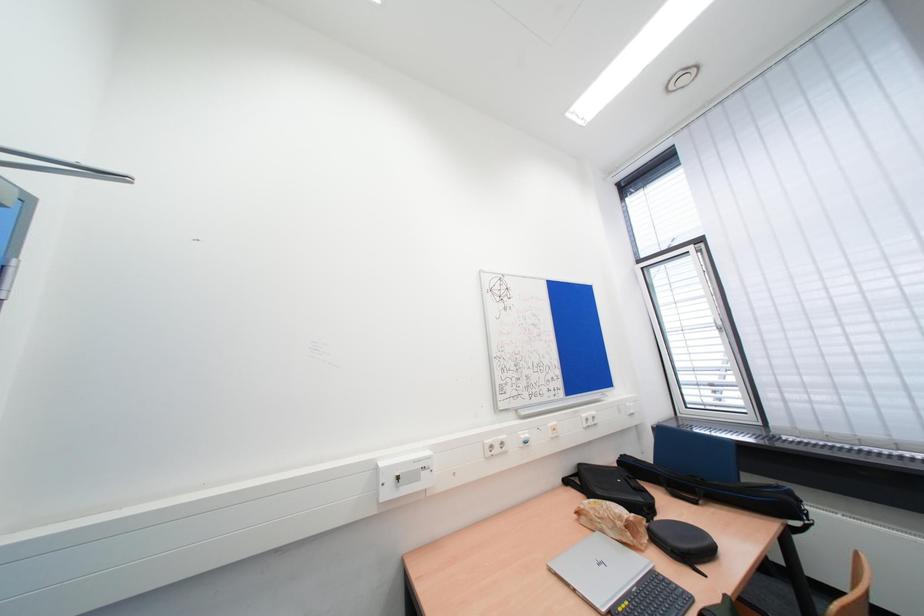
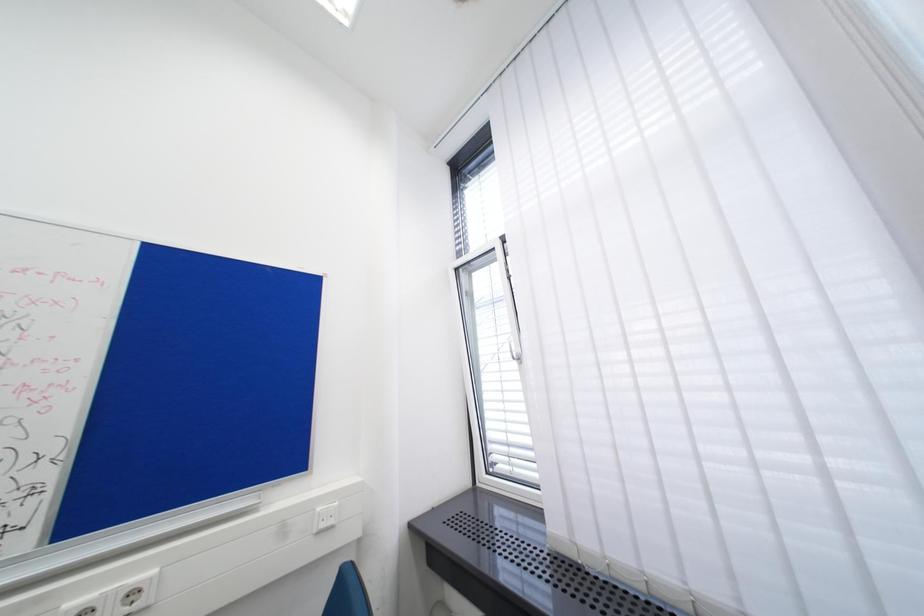
The images are taken continuously from a first-person perspective. In which direction are you moving?

The cameraman moved toward right, forward.